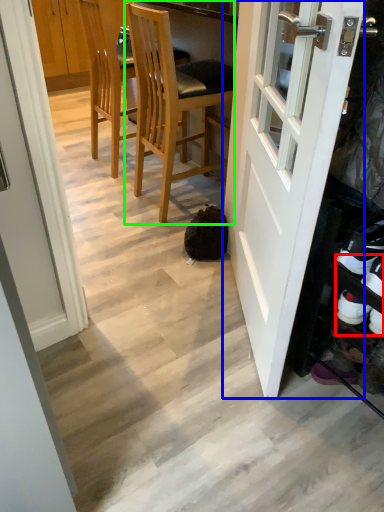
Question: Considering the real-world distances, which object is closest to shoe (highlighted by a red box)? door (highlighted by a blue box) or chair (highlighted by a green box).

Choices:
 (A) door
 (B) chair

Answer: (A)